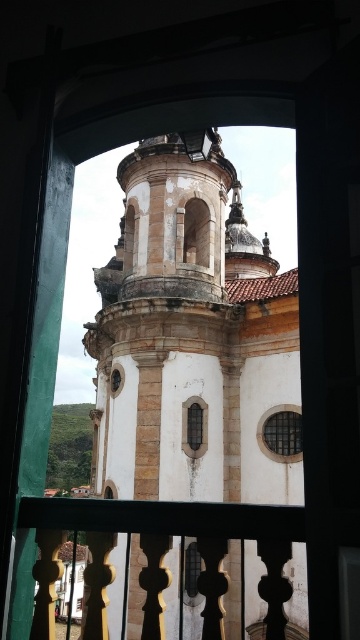
Is polished wood railing at center smaller than metallic grid window at center?

No.

Does polished wood railing at center have a greater width compared to metallic grid window at center?

Indeed, polished wood railing at center has a greater width compared to metallic grid window at center.

Between point (201, 515) and point (270, 428), which one is positioned behind?

Positioned behind is point (270, 428).

Identify the location of polished wood railing at center. (162, 556).

I want to click on metallic grid window at center, so click(282, 433).

Does point (276, 448) come in front of point (195, 428)?

No, (276, 448) is further to viewer.

This screenshot has width=360, height=640. I want to click on metallic grid window at center, so click(x=282, y=433).

Who is higher up, polished wood railing at center or clear glass window at center?

clear glass window at center

Where is `polished wood railing at center`? The height and width of the screenshot is (640, 360). polished wood railing at center is located at coordinates (162, 556).